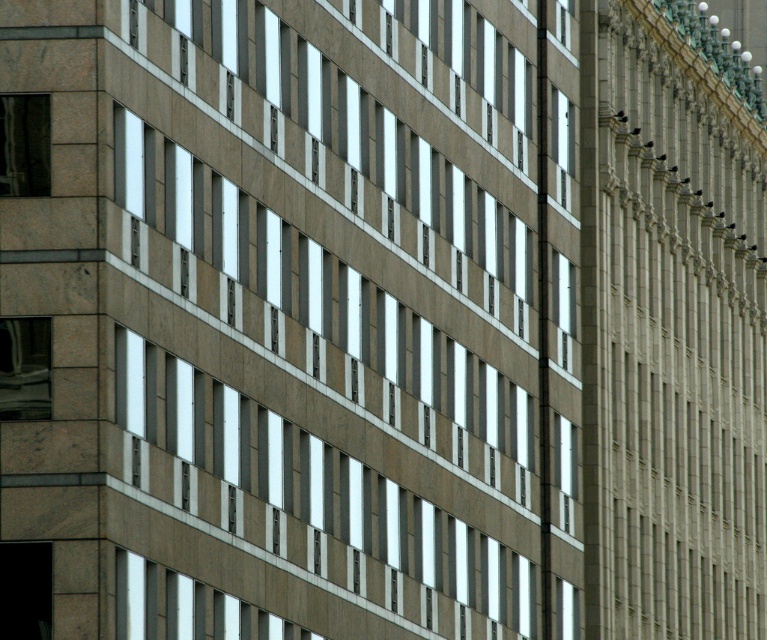
You are standing in front of the building shown in the image. There is a matte glass window at upper left represented by point (25,145). Can you tell me the exact coordinates of this window?

The exact coordinates of the matte glass window at upper left are point (25,145).

Consider the image. You are standing in front of the building and want to know which window is nearer to you. Can you tell me which one is closer between the matte glass window at upper left and the clear glass window at center?

The matte glass window at upper left is closer to the viewer than the clear glass window at center.

You are a window installer working on a building. You need to place a new window that is 15 meters wide between the matte glass window at upper left and the matte glass window at upper center. Is there enough space between them to fit the new window?

The distance between the matte glass window at upper left and the matte glass window at upper center is 30.04 meters. Since the new window is 15 meters wide, there is sufficient space to fit it between them.